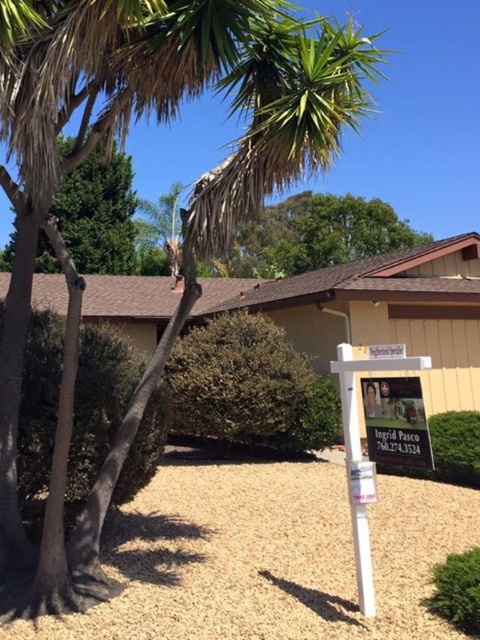
Is white plastic sign at lower right above green leafy bush at lower right?

Correct, white plastic sign at lower right is located above green leafy bush at lower right.

Can you confirm if white plastic sign at lower right is positioned below green leafy bush at lower right?

No, white plastic sign at lower right is not below green leafy bush at lower right.

The width and height of the screenshot is (480, 640). In order to click on white plastic sign at lower right in this screenshot , I will do `click(362, 458)`.

Does green leafy bush at center appear under metallic silver sign at center?

Yes.

Locate an element on the screen. The image size is (480, 640). green leafy bush at center is located at coordinates (243, 385).

Is point (323, 403) closer to viewer compared to point (411, 461)?

No, it is behind (411, 461).

At what (x,y) coordinates should I click in order to perform the action: click on green leafy bush at center. Please return your answer as a coordinate pair (x, y). The image size is (480, 640). Looking at the image, I should click on (243, 385).

Is green leafy tree at upper left to the right of metallic silver sign at center from the viewer's perspective?

No, green leafy tree at upper left is not to the right of metallic silver sign at center.

Is green leafy tree at upper left further to the viewer compared to metallic silver sign at center?

That is True.

Which is in front, point (127, 189) or point (362, 397)?

Point (362, 397) is more forward.

Identify the location of green leafy tree at upper left. (98, 212).